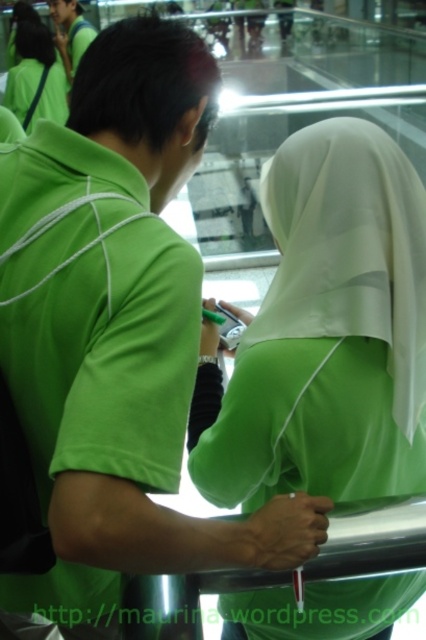
Can you confirm if green satin hijab at center is positioned above matte green shirt at upper left?

Actually, green satin hijab at center is below matte green shirt at upper left.

Does green satin hijab at center lie behind matte green shirt at upper left?

No.

Who is more distant from viewer, (383, 627) or (66, 32)?

Point (66, 32)

At what (x,y) coordinates should I click in order to perform the action: click on green satin hijab at center. Please return your answer as a coordinate pair (x, y). Looking at the image, I should click on (325, 333).

Can you confirm if matte green hijab at upper left is wider than matte green shirt at upper left?

Correct, the width of matte green hijab at upper left exceeds that of matte green shirt at upper left.

From the picture: Who is more distant from viewer, [54,68] or [65,67]?

Point [65,67]

This screenshot has width=426, height=640. In order to click on matte green hijab at upper left in this screenshot , I will do `click(36, 77)`.

From the picture: Between green satin hijab at center and matte green hijab at upper left, which one has more height?

matte green hijab at upper left

Does green satin hijab at center have a lesser height compared to matte green hijab at upper left?

Yes, green satin hijab at center is shorter than matte green hijab at upper left.

Identify the location of green satin hijab at center. (325, 333).